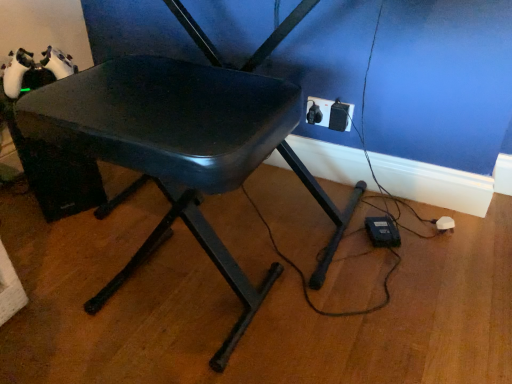
Question: Can you confirm if black plastic outlet at lower right is shorter than matte black chair at center?

Choices:
 (A) no
 (B) yes

Answer: (B)

Question: From the image's perspective, is black plastic outlet at lower right beneath matte black chair at center?

Choices:
 (A) no
 (B) yes

Answer: (A)

Question: Is the surface of black plastic outlet at lower right in direct contact with matte black chair at center?

Choices:
 (A) no
 (B) yes

Answer: (A)

Question: Does black plastic outlet at lower right have a larger size compared to matte black chair at center?

Choices:
 (A) yes
 (B) no

Answer: (B)

Question: Is black plastic outlet at lower right facing towards matte black chair at center?

Choices:
 (A) yes
 (B) no

Answer: (A)

Question: Considering the relative sizes of black plastic outlet at lower right and matte black chair at center in the image provided, is black plastic outlet at lower right smaller than matte black chair at center?

Choices:
 (A) no
 (B) yes

Answer: (B)

Question: Is matte black chair at center in front of black plastic outlet at lower right?

Choices:
 (A) yes
 (B) no

Answer: (A)

Question: Is black plastic outlet at lower right a part of matte black chair at center?

Choices:
 (A) no
 (B) yes

Answer: (A)

Question: Are matte black chair at center and black plastic outlet at lower right far apart?

Choices:
 (A) no
 (B) yes

Answer: (A)

Question: Can you confirm if matte black chair at center is taller than black plastic outlet at lower right?

Choices:
 (A) yes
 (B) no

Answer: (A)

Question: Is matte black chair at center wider than black plastic outlet at lower right?

Choices:
 (A) no
 (B) yes

Answer: (B)

Question: Is matte black chair at center aimed at black plastic outlet at lower right?

Choices:
 (A) no
 (B) yes

Answer: (A)

Question: Looking at the image, does black plastic outlet at lower right seem bigger or smaller compared to matte black chair at center?

Choices:
 (A) big
 (B) small

Answer: (B)